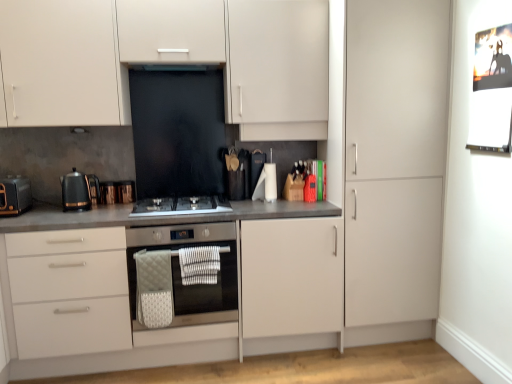
Image resolution: width=512 pixels, height=384 pixels. What are the coordinates of `vacant space to the right of copper metallic kettle at center-left, arranged as the second appliance when viewed from the left` in the screenshot? It's located at (147, 196).